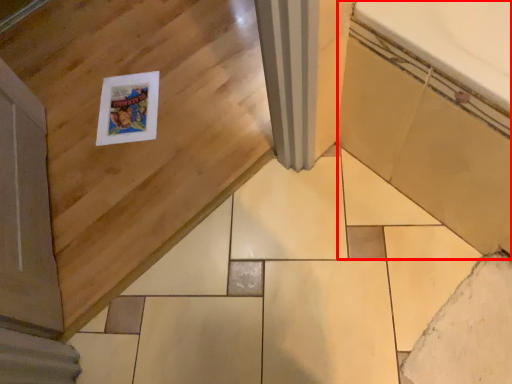
Question: In this image, where is bath (annotated by the red box) located relative to ceramic tile?

Choices:
 (A) left
 (B) right

Answer: (B)